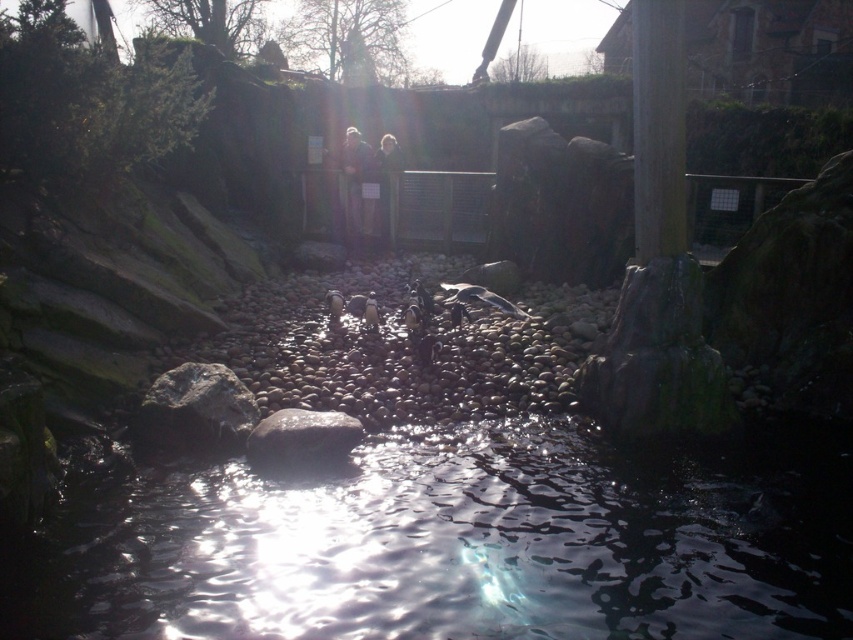
You are a zookeeper who needs to place a 3 meter long plank between the transparent water at center and the smooth gray rock at lower left. Will the plank fit between them?

The transparent water at center and smooth gray rock at lower left are 3.12 meters apart from each other. Since the plank is exactly 3 meters long, it will fit with a small amount of space remaining between them.